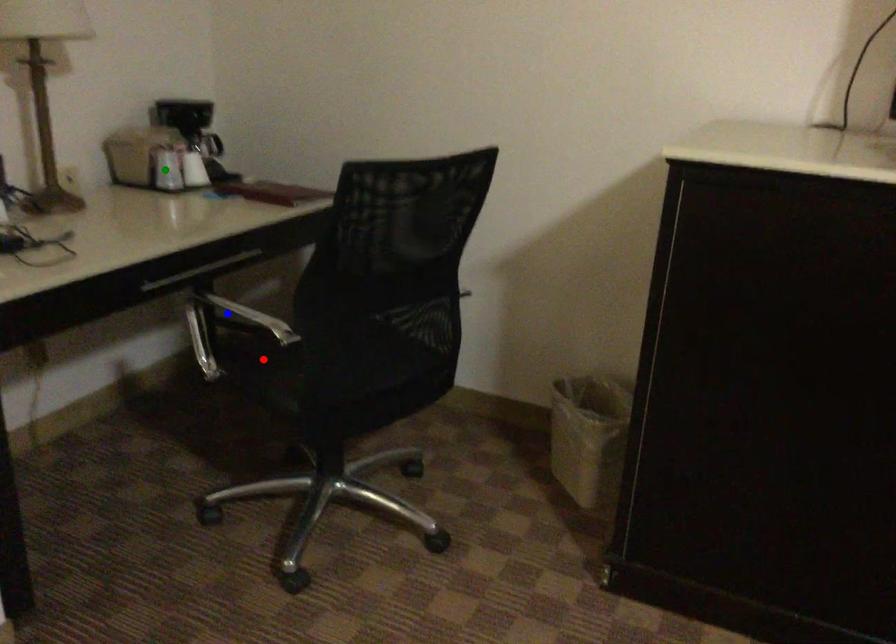
Order these from farthest to nearest:
blue point, green point, red point

blue point < green point < red point